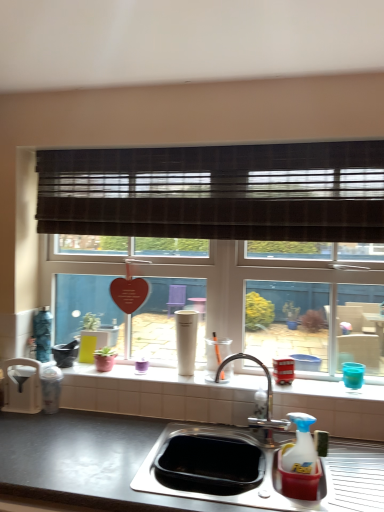
Identify the location of free spot above white glossy window sill at center (from a real-world perspective). (180, 368).